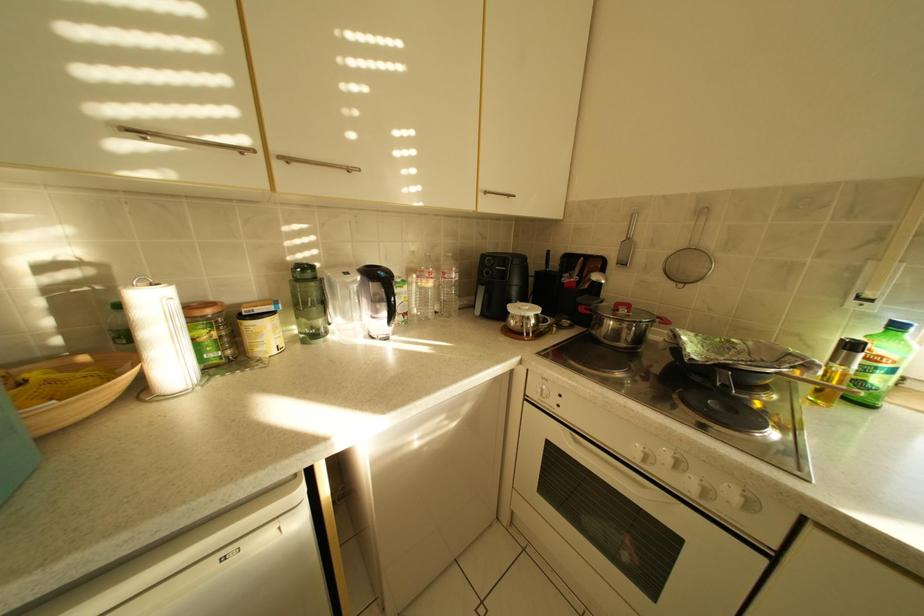
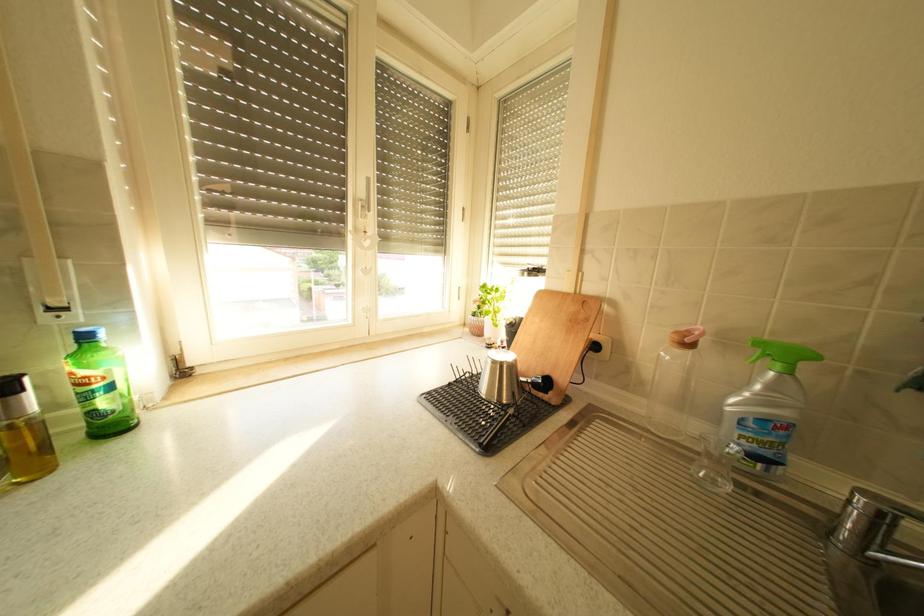
Question: How did the camera likely rotate?

Choices:
 (A) Left
 (B) Right
 (C) Up
 (D) Down

Answer: (B)